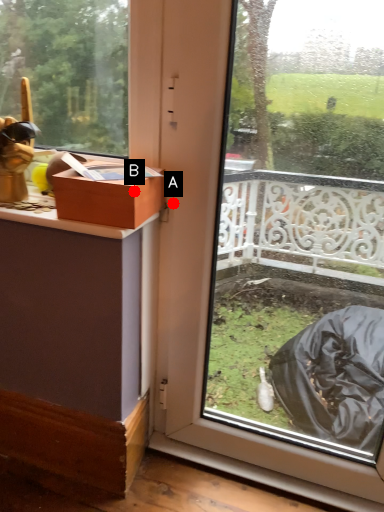
Question: Two points are circled on the image, labeled by A and B beside each circle. Which of the following is the farthest from the observer?

Choices:
 (A) A is further
 (B) B is further

Answer: (A)